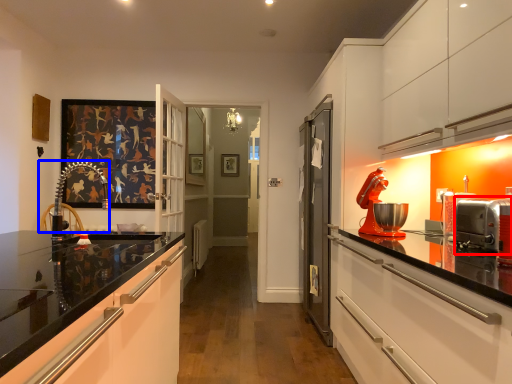
Question: Which of the following is the closest to the observer, appliance (highlighted by a red box) or chair (highlighted by a blue box)?

Choices:
 (A) appliance
 (B) chair

Answer: (A)